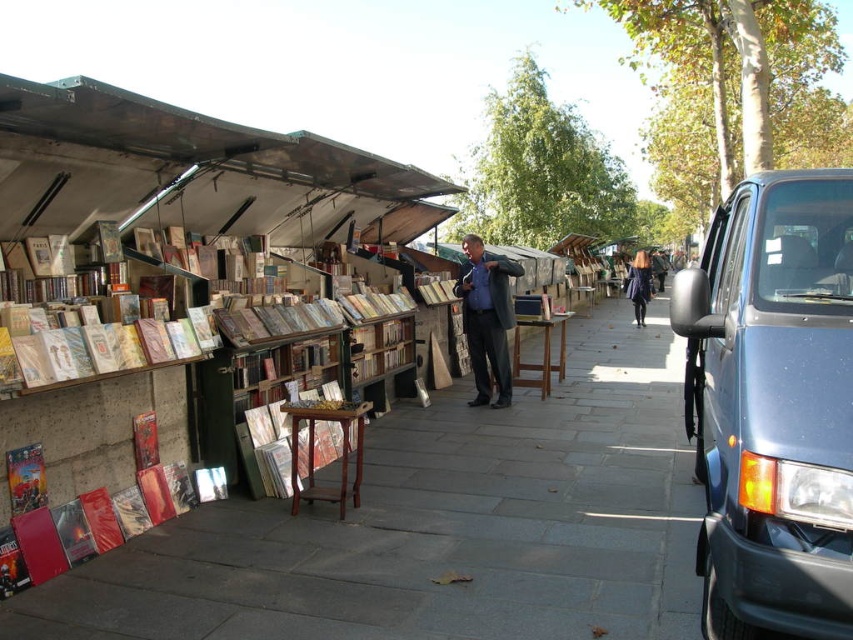
Question: Which point is closer to the camera?

Choices:
 (A) red glossy book at lower left
 (B) blue fabric jacket at center
 (C) metallic blue van at right

Answer: (C)

Question: In this image, where is red glossy book at lower left located relative to dark blue coat at center?

Choices:
 (A) below
 (B) above

Answer: (A)

Question: Estimate the real-world distances between objects in this image. Which object is closer to the red glossy book at lower left?

Choices:
 (A) metallic blue van at right
 (B) dark blue coat at center
 (C) smooth concrete pavement at center

Answer: (C)

Question: Based on their relative distances, which object is farther from the dark blue coat at center?

Choices:
 (A) blue fabric jacket at center
 (B) red glossy book at lower left
 (C) smooth concrete pavement at center

Answer: (B)

Question: Is smooth concrete pavement at center further to the viewer compared to red glossy book at lower left?

Choices:
 (A) no
 (B) yes

Answer: (A)

Question: Is smooth concrete pavement at center to the right of dark blue coat at center from the viewer's perspective?

Choices:
 (A) no
 (B) yes

Answer: (A)